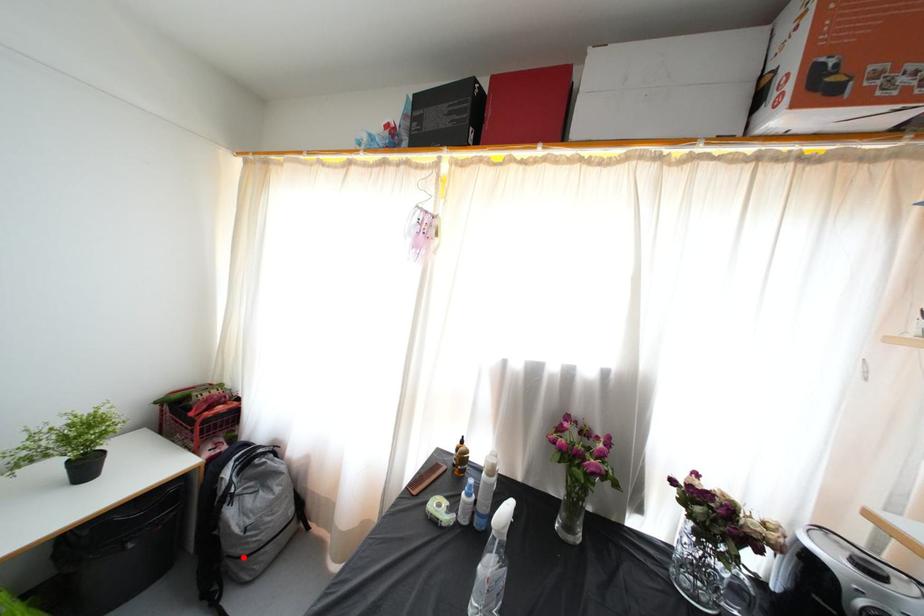
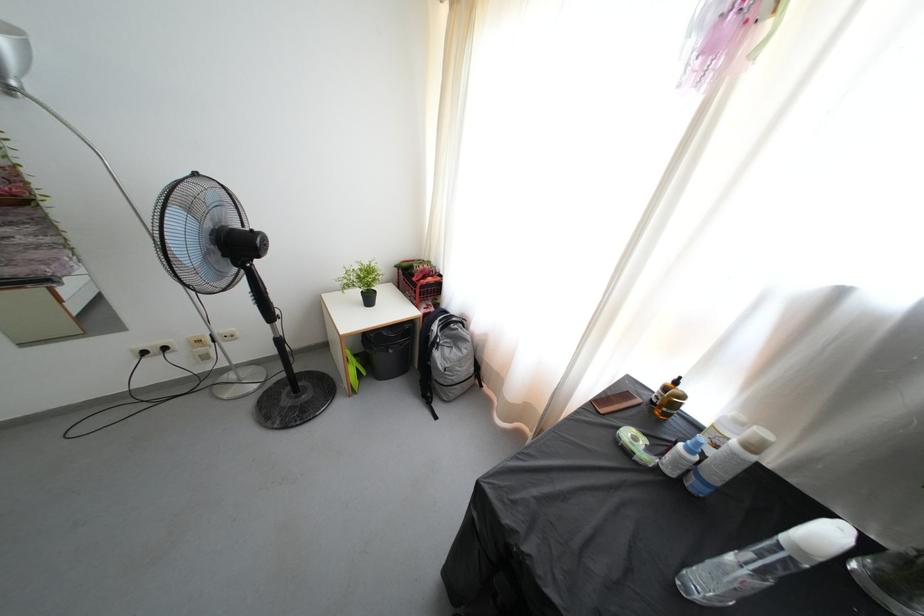
Question: I am providing you with two images of the same scene from different viewpoints. In image1, a red point is highlighted. Considering the same 3D point in image2, which of the following is correct?

Choices:
 (A) It is closer
 (B) It is farther

Answer: (B)